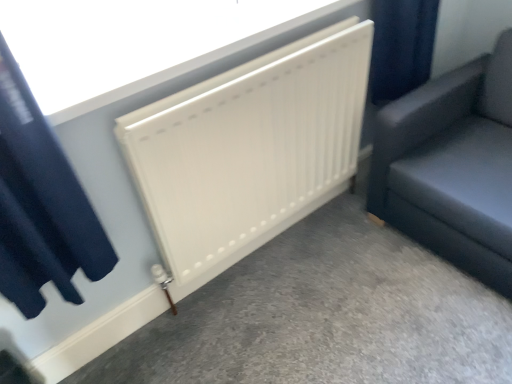
Question: From the image's perspective, is white matte radiator at center above dark blue velvet curtain at upper left?

Choices:
 (A) no
 (B) yes

Answer: (A)

Question: Is white matte radiator at center far from dark blue velvet curtain at upper left?

Choices:
 (A) no
 (B) yes

Answer: (A)

Question: Is white matte radiator at center wider than dark blue velvet curtain at upper left?

Choices:
 (A) yes
 (B) no

Answer: (A)

Question: Is dark blue velvet curtain at upper left inside white matte radiator at center?

Choices:
 (A) yes
 (B) no

Answer: (B)

Question: Is white matte radiator at center at the right side of dark blue velvet curtain at upper left?

Choices:
 (A) yes
 (B) no

Answer: (A)

Question: From the image's perspective, is white matte radiator at center located above or below dark blue velvet curtain at upper left?

Choices:
 (A) below
 (B) above

Answer: (B)

Question: In terms of width, does white matte radiator at center look wider or thinner when compared to dark blue velvet curtain at upper left?

Choices:
 (A) thin
 (B) wide

Answer: (B)

Question: Relative to dark blue velvet curtain at upper left, is white matte radiator at center in front or behind?

Choices:
 (A) front
 (B) behind

Answer: (B)

Question: Is point (136, 28) closer or farther from the camera than point (22, 137)?

Choices:
 (A) closer
 (B) farther

Answer: (B)

Question: Is matte black sofa at right bigger or smaller than white matte radiator at center?

Choices:
 (A) small
 (B) big

Answer: (B)

Question: From the image's perspective, is matte black sofa at right positioned above or below white matte radiator at center?

Choices:
 (A) above
 (B) below

Answer: (A)

Question: In terms of height, does matte black sofa at right look taller or shorter compared to white matte radiator at center?

Choices:
 (A) short
 (B) tall

Answer: (B)

Question: In the image, is matte black sofa at right on the left side or the right side of white matte radiator at center?

Choices:
 (A) left
 (B) right

Answer: (B)

Question: Is dark blue velvet curtain at upper left wider or thinner than matte black sofa at right?

Choices:
 (A) wide
 (B) thin

Answer: (B)

Question: From a real-world perspective, is dark blue velvet curtain at upper left above or below matte black sofa at right?

Choices:
 (A) below
 (B) above

Answer: (B)